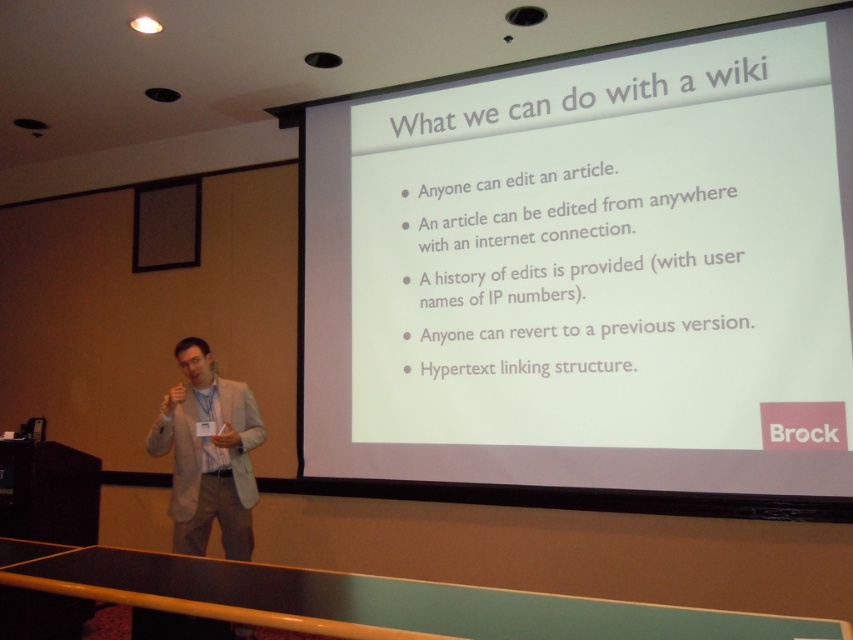
Question: Is white matte projector screen at upper center to the left of light gray suit at center from the viewer's perspective?

Choices:
 (A) yes
 (B) no

Answer: (B)

Question: Observing the image, what is the correct spatial positioning of white matte projector screen at upper center in reference to light gray suit at center?

Choices:
 (A) below
 (B) above

Answer: (B)

Question: From the image, what is the correct spatial relationship of white matte projector screen at upper center in relation to light gray suit at center?

Choices:
 (A) right
 (B) left

Answer: (A)